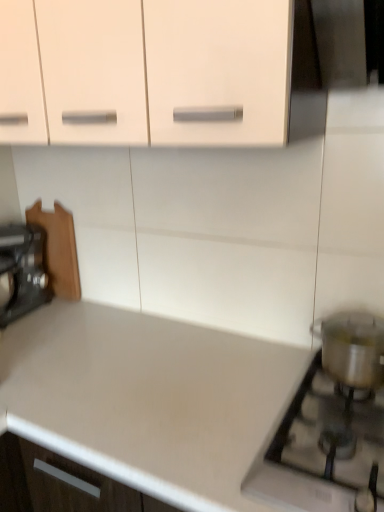
Question: Is point (360, 399) positioned closer to the camera than point (190, 343)?

Choices:
 (A) closer
 (B) farther

Answer: (A)

Question: Looking at the image, does satin silver pot at lower right seem bigger or smaller compared to white matte countertop at lower right?

Choices:
 (A) small
 (B) big

Answer: (A)

Question: Based on their relative distances, which object is farther from the white matte countertop at lower right?

Choices:
 (A) metallic silver pot at right
 (B) wooden cutting board at left
 (C) matte white cabinet at upper center
 (D) satin silver pot at lower right

Answer: (C)

Question: Which object is positioned farthest from the satin silver pot at lower right?

Choices:
 (A) metallic silver pot at right
 (B) matte white cabinet at upper center
 (C) white matte countertop at lower right
 (D) wooden cutting board at left

Answer: (D)